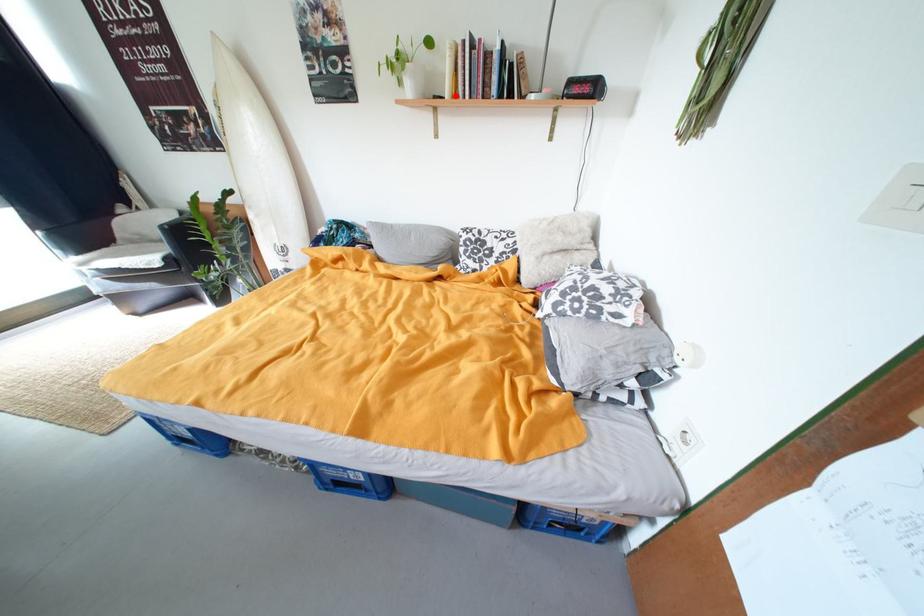
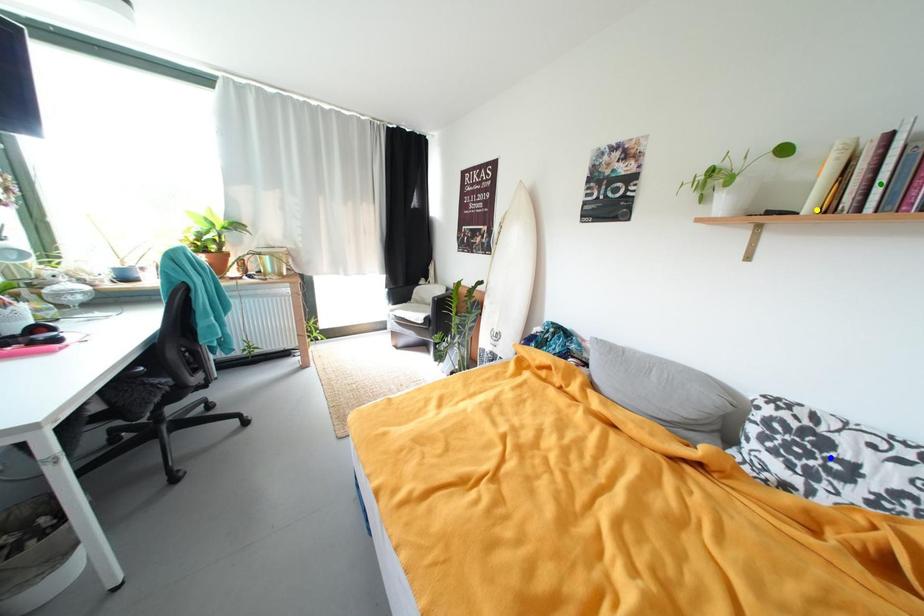
Question: I am providing you with two images of the same scene from different viewpoints. A red point is marked on the first image. You are given multiple points on the second image. Which point in image 2 represents the same 3d spot as the red point in image 1?

Choices:
 (A) blue point
 (B) green point
 (C) yellow point

Answer: (C)